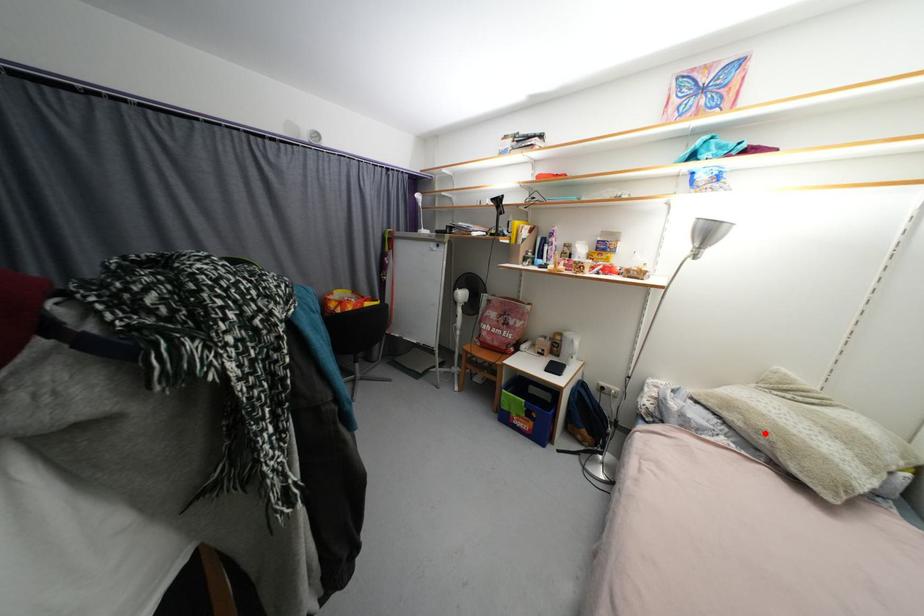
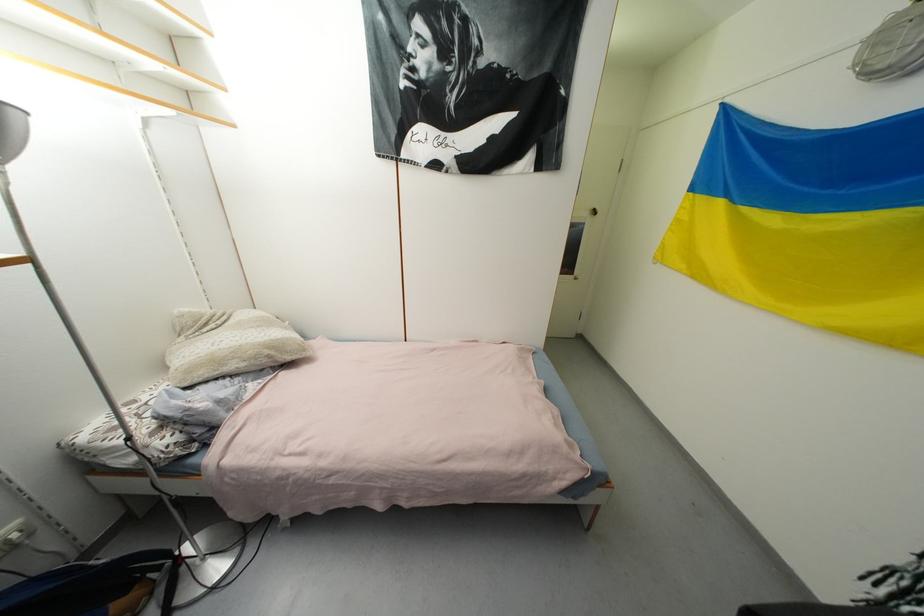
The point at the highlighted location is marked in the first image. Where is the corresponding point in the second image?

(261, 359)